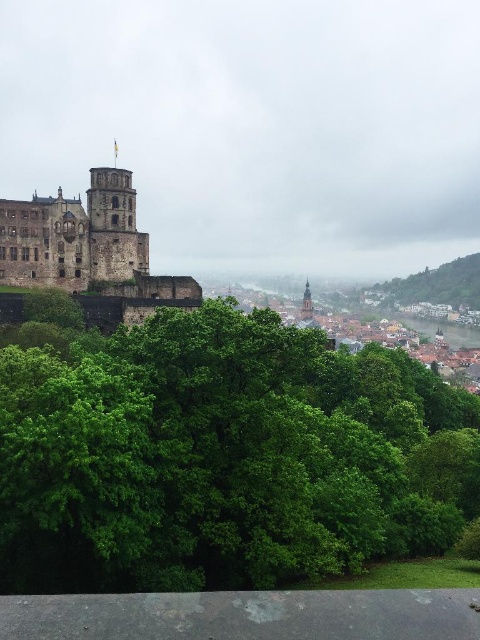
Between point (119, 564) and point (462, 273), which one is positioned behind?

Point (462, 273)

Does green leafy tree at center have a smaller size compared to green leafy tree at lower right?

Actually, green leafy tree at center might be larger than green leafy tree at lower right.

Measure the distance between green leafy tree at center and camera.

208.36 feet

At what (x,y) coordinates should I click in order to perform the action: click on green leafy tree at center. Please return your answer as a coordinate pair (x, y). The width and height of the screenshot is (480, 640). Looking at the image, I should click on (220, 458).

Between green leafy tree at center and green stone tower at center, which one has more height?

green leafy tree at center

Is green leafy tree at center in front of green stone tower at center?

Yes, green leafy tree at center is closer to the viewer.

Locate an element on the screen. green leafy tree at center is located at coordinates click(x=220, y=458).

Who is shorter, brown stone castle at left or green leafy tree at lower right?

green leafy tree at lower right is shorter.

Which is in front, point (193, 292) or point (472, 268)?

Positioned in front is point (193, 292).

Which is behind, point (91, 189) or point (479, 269)?

The point (479, 269) is behind.

You are a GUI agent. You are given a task and a screenshot of the screen. Output one action in this format:
    pyautogui.click(x=<x>, y=<y>)
    Task: Click on the brown stone castle at left
    The height and width of the screenshot is (640, 480).
    Given the screenshot: What is the action you would take?
    pyautogui.click(x=90, y=252)